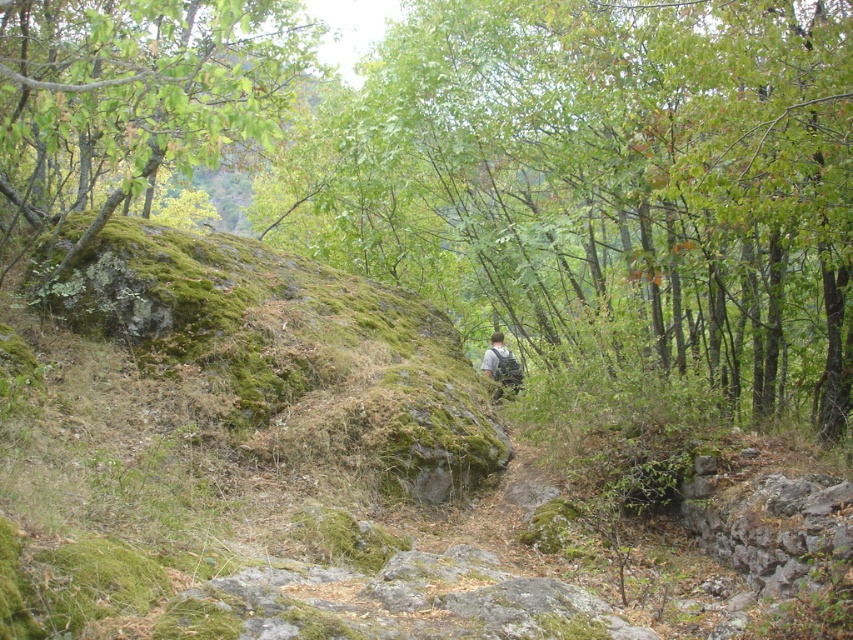
Question: Among these points, which one is farthest from the camera?

Choices:
 (A) (88, 92)
 (B) (486, 356)
 (C) (448, 272)
 (D) (263, 352)

Answer: (C)

Question: Which point is closer to the camera?

Choices:
 (A) green mossy rock at center-left
 (B) green mossy rock at center
 (C) green mossy rock at upper left
 (D) green fabric backpack at center

Answer: (C)

Question: Is green mossy rock at center to the left of green mossy rock at center-left from the viewer's perspective?

Choices:
 (A) no
 (B) yes

Answer: (A)

Question: In this image, where is green mossy rock at center located relative to green mossy rock at center-left?

Choices:
 (A) right
 (B) left

Answer: (A)

Question: Does green mossy rock at center-left appear on the right side of green fabric backpack at center?

Choices:
 (A) yes
 (B) no

Answer: (B)

Question: Which of the following is the closest to the observer?

Choices:
 (A) green mossy rock at center-left
 (B) green mossy rock at center
 (C) green fabric backpack at center
 (D) green mossy rock at upper left

Answer: (D)